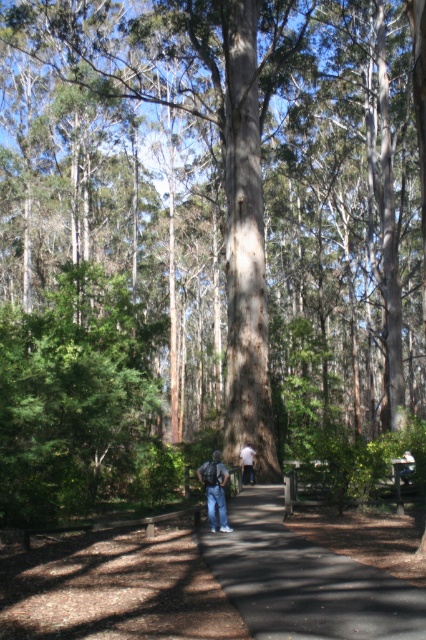
You are a hiker who wants to cross the dark brown asphalt at center and the denim jeans at center. Which object is lower in height so you can step over it easily?

The dark brown asphalt at center is shorter than denim jeans at center, so you can step over the dark brown asphalt at center easily.

You are a hiker who has lost your way in the forest. You see the denim jeans at center and the white cotton shirt at center. Which item is closer to you?

The denim jeans at center is in front of the white cotton shirt at center, so the denim jeans at center is closer to you.

You are a hiker who has lost their backpack. You see the denim jeans at center and the white cotton shirt at center on the forest pathway. Which item is closer to the left side of the path?

The denim jeans at center is to the left of white cotton shirt at center, so the denim jeans at center is closer to the left side of the path.